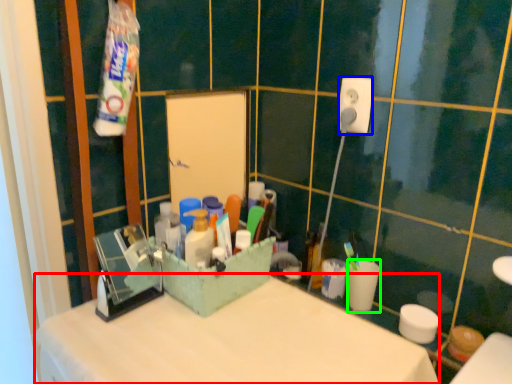
Question: Which is farther away from counter top (highlighted by a red box)? power plugs and sockets (highlighted by a blue box) or coffee cup (highlighted by a green box)?

Choices:
 (A) power plugs and sockets
 (B) coffee cup

Answer: (A)